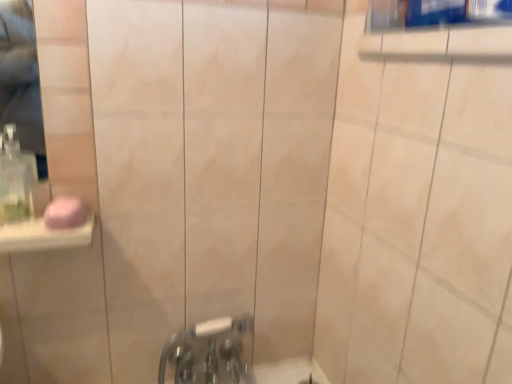
In order to click on chrome metallic faucet at lower center in this screenshot , I will do `click(209, 352)`.

Locate an element on the screen. chrome metallic faucet at lower center is located at coordinates (209, 352).

Is pink matte soap at left wider or thinner than chrome metallic faucet at lower center?

Clearly, pink matte soap at left has less width compared to chrome metallic faucet at lower center.

Is pink matte soap at left far from chrome metallic faucet at lower center?

No, there isn't a large distance between pink matte soap at left and chrome metallic faucet at lower center.

Could you tell me if pink matte soap at left is facing chrome metallic faucet at lower center?

No, pink matte soap at left does not turn towards chrome metallic faucet at lower center.

From the image's perspective, relative to chrome metallic faucet at lower center, is pink matte soap at left above or below?

From the image's perspective, pink matte soap at left appears above chrome metallic faucet at lower center.

Looking at this image, is chrome metallic faucet at lower center facing away from pink matte soap at left?

No, pink matte soap at left is not at the back of chrome metallic faucet at lower center.

Which of these two, chrome metallic faucet at lower center or pink matte soap at left, stands taller?

With more height is chrome metallic faucet at lower center.

Is chrome metallic faucet at lower center closer to the viewer compared to pink matte soap at left?

No.

Is chrome metallic faucet at lower center not inside pink matte soap at left?

Yes, chrome metallic faucet at lower center is not within pink matte soap at left.

Is clear plastic soap dispenser at left next to chrome metallic faucet at lower center?

No, clear plastic soap dispenser at left is not in contact with chrome metallic faucet at lower center.

From a real-world perspective, who is located lower, clear plastic soap dispenser at left or chrome metallic faucet at lower center?

In real-world perspective, chrome metallic faucet at lower center is lower.

In terms of height, does clear plastic soap dispenser at left look taller or shorter compared to chrome metallic faucet at lower center?

Considering their sizes, clear plastic soap dispenser at left has less height than chrome metallic faucet at lower center.

Is clear plastic soap dispenser at left inside or outside of chrome metallic faucet at lower center?

clear plastic soap dispenser at left cannot be found inside chrome metallic faucet at lower center.

Is chrome metallic faucet at lower center with clear plastic soap dispenser at left?

They are not placed beside each other.

Does chrome metallic faucet at lower center appear on the left side of clear plastic soap dispenser at left?

Incorrect, chrome metallic faucet at lower center is not on the left side of clear plastic soap dispenser at left.

From a real-world perspective, is chrome metallic faucet at lower center on top of clear plastic soap dispenser at left?

No.

Is chrome metallic faucet at lower center positioned with its back to clear plastic soap dispenser at left?

chrome metallic faucet at lower center is not turned away from clear plastic soap dispenser at left.

From a real-world perspective, is clear plastic soap dispenser at left under pink matte soap at left?

Actually, clear plastic soap dispenser at left is physically above pink matte soap at left in the real world.

Is pink matte soap at left at the back of clear plastic soap dispenser at left?

No.

Is clear plastic soap dispenser at left wider than pink matte soap at left?

No, clear plastic soap dispenser at left is not wider than pink matte soap at left.

From the image's perspective, would you say pink matte soap at left is shown under clear plastic soap dispenser at left?

Yes.

The width and height of the screenshot is (512, 384). Identify the location of soap lying on the right of clear plastic soap dispenser at left. (65, 213).

Based on the photo, considering the sizes of objects pink matte soap at left and clear plastic soap dispenser at left in the image provided, who is bigger, pink matte soap at left or clear plastic soap dispenser at left?

Bigger between the two is clear plastic soap dispenser at left.

You are a GUI agent. You are given a task and a screenshot of the screen. Output one action in this format:
    pyautogui.click(x=<x>, y=<y>)
    Task: Click on the tap below the pink matte soap at left (from the image's perspective)
    The height and width of the screenshot is (384, 512).
    Given the screenshot: What is the action you would take?
    pos(209,352)

You are a GUI agent. You are given a task and a screenshot of the screen. Output one action in this format:
    pyautogui.click(x=<x>, y=<y>)
    Task: Click on the tap behind the pink matte soap at left
    The image size is (512, 384).
    Given the screenshot: What is the action you would take?
    pyautogui.click(x=209, y=352)

Which object lies further to the anchor point pink matte soap at left, chrome metallic faucet at lower center or clear plastic soap dispenser at left?

chrome metallic faucet at lower center is further to pink matte soap at left.

Estimate the real-world distances between objects in this image. Which object is closer to clear plastic soap dispenser at left, chrome metallic faucet at lower center or pink matte soap at left?

pink matte soap at left is positioned closer to the anchor clear plastic soap dispenser at left.

Estimate the real-world distances between objects in this image. Which object is closer to chrome metallic faucet at lower center, clear plastic soap dispenser at left or pink matte soap at left?

pink matte soap at left is closer to chrome metallic faucet at lower center.

Which object lies further to the anchor point chrome metallic faucet at lower center, pink matte soap at left or clear plastic soap dispenser at left?

Based on the image, clear plastic soap dispenser at left appears to be further to chrome metallic faucet at lower center.

Considering their positions, is clear plastic soap dispenser at left positioned further to pink matte soap at left than chrome metallic faucet at lower center?

Among the two, chrome metallic faucet at lower center is located further to pink matte soap at left.

Which object lies nearer to the anchor point clear plastic soap dispenser at left, pink matte soap at left or chrome metallic faucet at lower center?

Among the two, pink matte soap at left is located nearer to clear plastic soap dispenser at left.

You are a GUI agent. You are given a task and a screenshot of the screen. Output one action in this format:
    pyautogui.click(x=<x>, y=<y>)
    Task: Click on the soap between clear plastic soap dispenser at left and chrome metallic faucet at lower center in the vertical direction
    
    Given the screenshot: What is the action you would take?
    pyautogui.click(x=65, y=213)